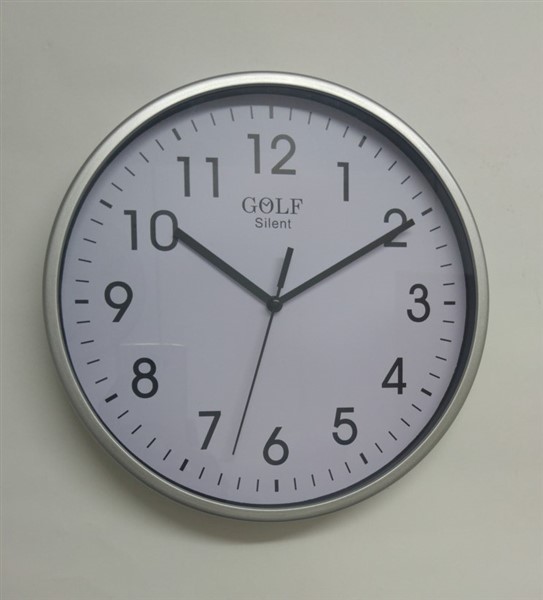
Image resolution: width=543 pixels, height=600 pixels. What are the coordinates of `rim of frame` in the screenshot? It's located at (351, 97).